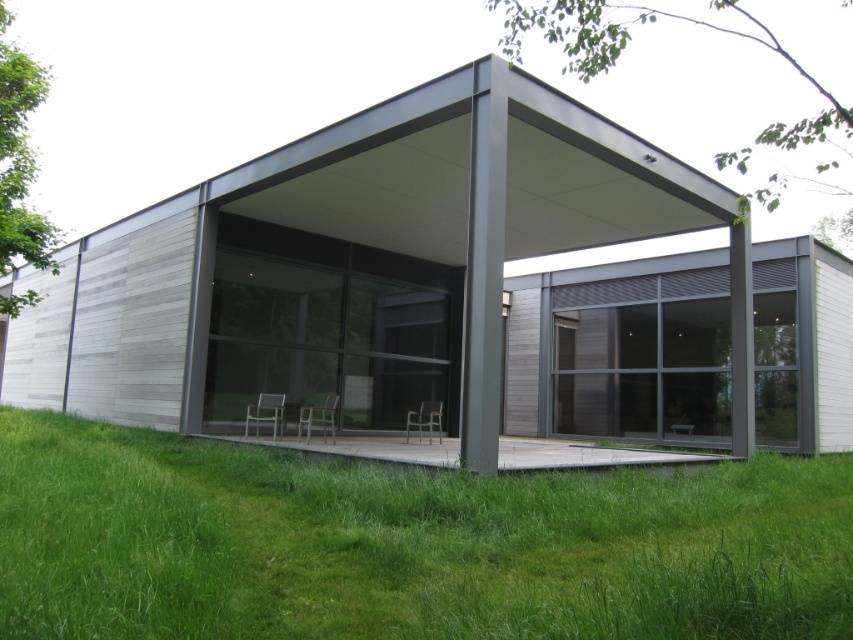
Question: Where is matte gray shelter at center located in relation to green grass at lower center in the image?

Choices:
 (A) right
 (B) left

Answer: (A)

Question: Is matte gray shelter at center below green grass at lower center?

Choices:
 (A) no
 (B) yes

Answer: (A)

Question: Is the position of matte gray shelter at center less distant than that of green grass at lower center?

Choices:
 (A) no
 (B) yes

Answer: (A)